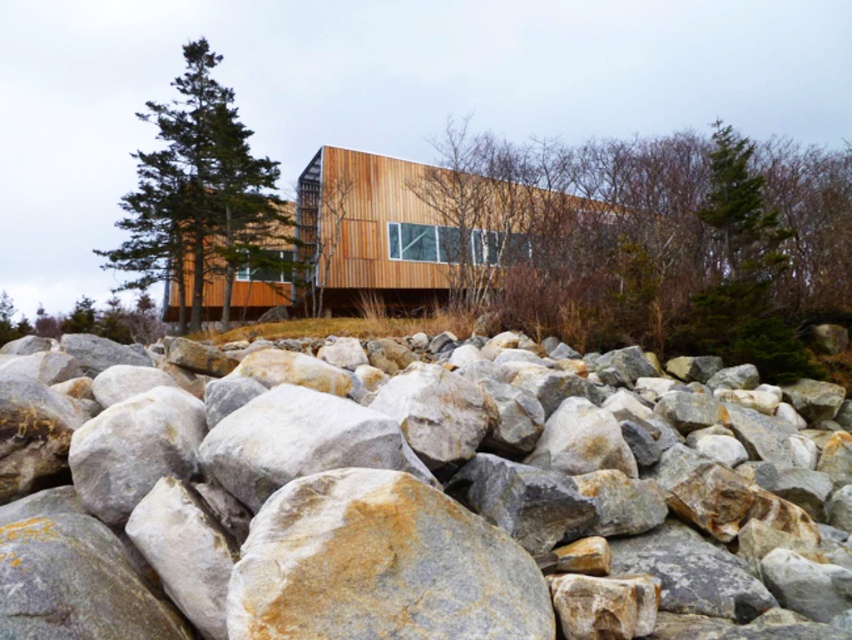
You are a visitor standing in front of the modern wooden building. You notice two trees in the scene. Which tree, the green leafy tree at center or the green matte tree at upper left, is taller?

The green leafy tree at center is much taller than the green matte tree at upper left.

You are standing in front of the building and want to walk to the nearest point between point (661,396) and point (775,292). Which point should you head towards?

Point (661,396) is closer to the viewer than point (775,292), so you should head towards point (661,396).